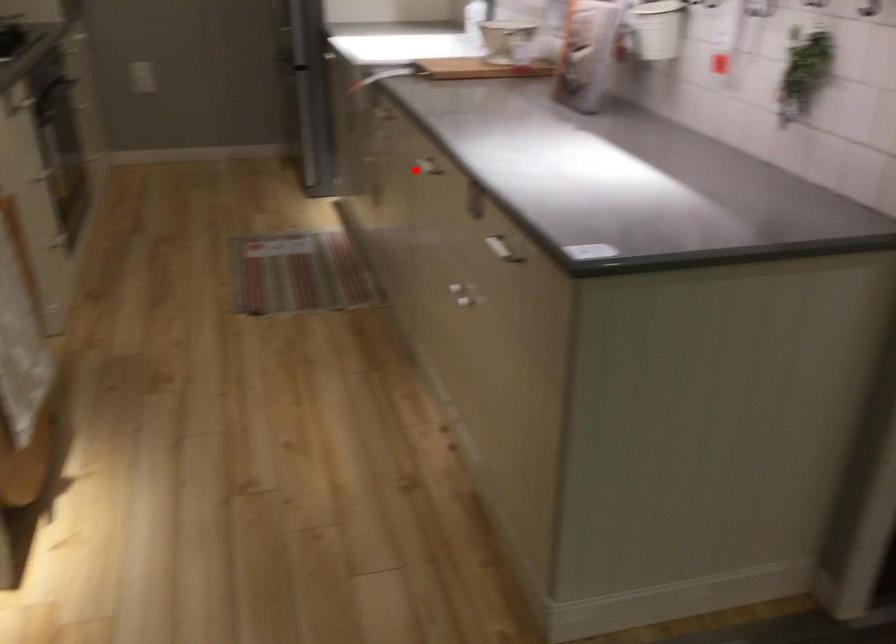
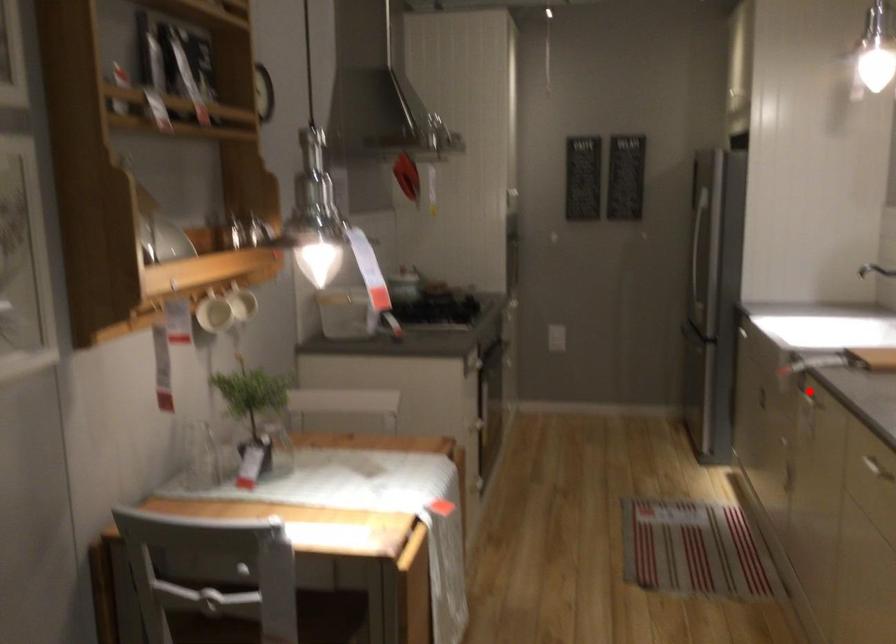
I am providing you with two images of the same scene from different viewpoints. A red point is marked on the first image and another point is marked on the second image. Is the marked point in image1 the same physical position as the marked point in image2?

No